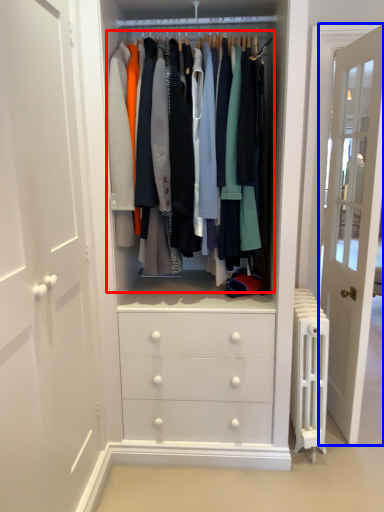
Question: Which object appears closest to the camera in this image, closet (highlighted by a red box) or door (highlighted by a blue box)?

Choices:
 (A) closet
 (B) door

Answer: (A)